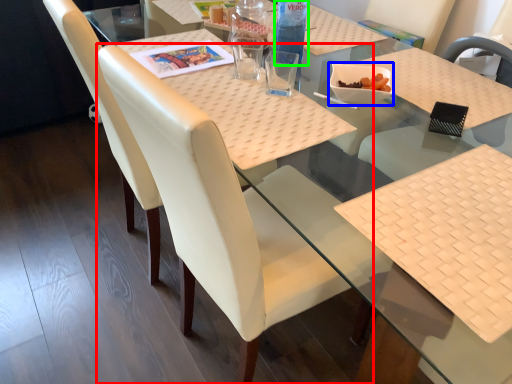
Question: Estimate the real-world distances between objects in this image. Which object is farther from chair (highlighted by a red box), food (highlighted by a blue box) or bottle (highlighted by a green box)?

Choices:
 (A) food
 (B) bottle

Answer: (B)